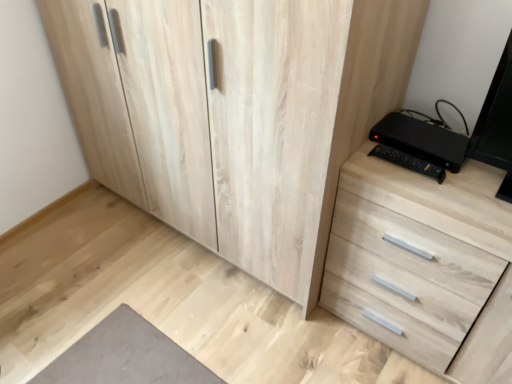
Question: From a real-world perspective, is light wood chest of drawers at right under natural wood cupboard at center?

Choices:
 (A) yes
 (B) no

Answer: (A)

Question: Considering the relative positions of light wood chest of drawers at right and natural wood cupboard at center in the image provided, is light wood chest of drawers at right in front of natural wood cupboard at center?

Choices:
 (A) yes
 (B) no

Answer: (B)

Question: Is natural wood cupboard at center completely or partially inside light wood chest of drawers at right?

Choices:
 (A) yes
 (B) no

Answer: (B)

Question: Would you say light wood chest of drawers at right is outside natural wood cupboard at center?

Choices:
 (A) no
 (B) yes

Answer: (B)

Question: Considering the relative positions of light wood chest of drawers at right and natural wood cupboard at center in the image provided, is light wood chest of drawers at right to the right of natural wood cupboard at center from the viewer's perspective?

Choices:
 (A) yes
 (B) no

Answer: (A)

Question: From a real-world perspective, is light wood chest of drawers at right positioned over natural wood cupboard at center based on gravity?

Choices:
 (A) yes
 (B) no

Answer: (B)

Question: Is black plastic at right turned away from light wood chest of drawers at right?

Choices:
 (A) yes
 (B) no

Answer: (B)

Question: Can you confirm if black plastic at right is positioned to the left of light wood chest of drawers at right?

Choices:
 (A) no
 (B) yes

Answer: (B)

Question: Is black plastic at right shorter than light wood chest of drawers at right?

Choices:
 (A) yes
 (B) no

Answer: (A)

Question: Does black plastic at right have a lesser width compared to light wood chest of drawers at right?

Choices:
 (A) yes
 (B) no

Answer: (A)

Question: Is the depth of black plastic at right less than that of light wood chest of drawers at right?

Choices:
 (A) yes
 (B) no

Answer: (B)

Question: Considering the relative sizes of black plastic at right and light wood chest of drawers at right in the image provided, is black plastic at right bigger than light wood chest of drawers at right?

Choices:
 (A) yes
 (B) no

Answer: (B)

Question: Is natural wood cupboard at center completely or partially outside of black plastic at right?

Choices:
 (A) yes
 (B) no

Answer: (A)